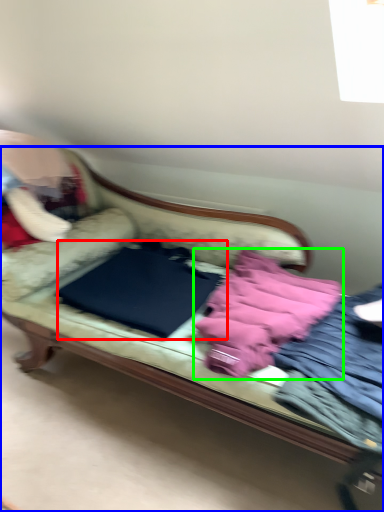
Question: Which is nearer to the sheet (highlighted by a red box)? studio couch (highlighted by a blue box) or material (highlighted by a green box).

Choices:
 (A) studio couch
 (B) material

Answer: (A)